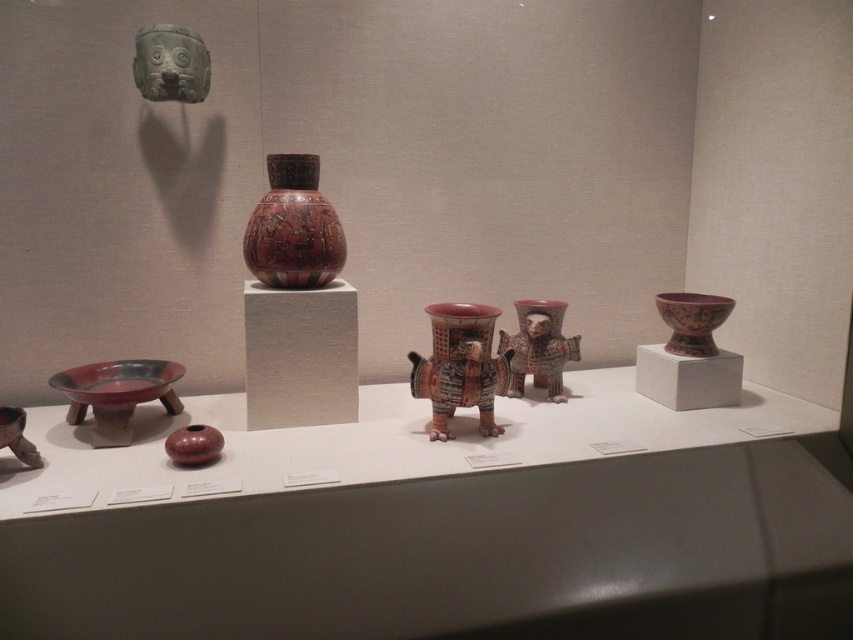
Question: Is polychrome ceramic vessel at center smaller than green stone mask at upper left?

Choices:
 (A) yes
 (B) no

Answer: (B)

Question: Which point is farther to the camera?

Choices:
 (A) green stone mask at upper left
 (B) matte clay vase at center

Answer: (A)

Question: Which point is closer to the camera?

Choices:
 (A) (689, 339)
 (B) (22, 492)
 (C) (436, 424)

Answer: (B)

Question: Among these points, which one is farthest from the camera?

Choices:
 (A) (665, 317)
 (B) (312, 220)

Answer: (A)

Question: Is matte ceramic bowl at center to the left of matte red bowl at center right from the viewer's perspective?

Choices:
 (A) no
 (B) yes

Answer: (B)

Question: Can you confirm if polychrome ceramic vessel at center is positioned to the right of polychrome ceramic figure at center?

Choices:
 (A) yes
 (B) no

Answer: (B)